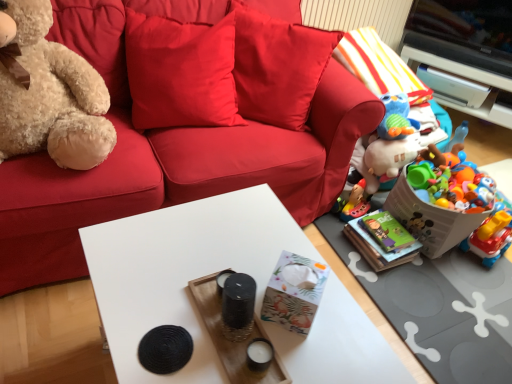
Question: Can you confirm if fuzzy beige teddy bear at left is positioned to the left of satin red pillow at upper center?

Choices:
 (A) yes
 (B) no

Answer: (A)

Question: Does fuzzy beige teddy bear at left lie behind satin red pillow at upper center?

Choices:
 (A) no
 (B) yes

Answer: (A)

Question: From the image's perspective, is fuzzy beige teddy bear at left located beneath satin red pillow at upper center?

Choices:
 (A) no
 (B) yes

Answer: (B)

Question: Can you confirm if fuzzy beige teddy bear at left is bigger than satin red pillow at upper center?

Choices:
 (A) yes
 (B) no

Answer: (A)

Question: Is fuzzy beige teddy bear at left wider than satin red pillow at upper center?

Choices:
 (A) yes
 (B) no

Answer: (A)

Question: Considering the relative positions of fuzzy beige teddy bear at left and satin red pillow at upper center in the image provided, is fuzzy beige teddy bear at left to the right of satin red pillow at upper center from the viewer's perspective?

Choices:
 (A) yes
 (B) no

Answer: (B)

Question: Is plastic colorful toys at right, the 2th toy when ordered from front to back, thinner than white glossy cabinet at upper right?

Choices:
 (A) no
 (B) yes

Answer: (A)

Question: Considering the relative sizes of plastic colorful toys at right, the 2th toy when ordered from right to left, and white glossy cabinet at upper right in the image provided, is plastic colorful toys at right, the 2th toy when ordered from right to left, shorter than white glossy cabinet at upper right?

Choices:
 (A) yes
 (B) no

Answer: (A)

Question: Is plastic colorful toys at right, the second toy positioned from the back, placed right next to white glossy cabinet at upper right?

Choices:
 (A) no
 (B) yes

Answer: (A)

Question: Considering the relative sizes of plastic colorful toys at right, the 2th toy when ordered from right to left, and white glossy cabinet at upper right in the image provided, is plastic colorful toys at right, the 2th toy when ordered from right to left, wider than white glossy cabinet at upper right?

Choices:
 (A) no
 (B) yes

Answer: (B)

Question: Is plastic colorful toys at right, the second toy positioned from the back, bigger than white glossy cabinet at upper right?

Choices:
 (A) no
 (B) yes

Answer: (A)

Question: Is white glossy cabinet at upper right at the back of plastic colorful toys at right, the 2th toy when ordered from right to left?

Choices:
 (A) no
 (B) yes

Answer: (A)

Question: Is velvet red couch at center taller than plastic toy basket at lower right, the 2th box viewed from the left?

Choices:
 (A) no
 (B) yes

Answer: (B)